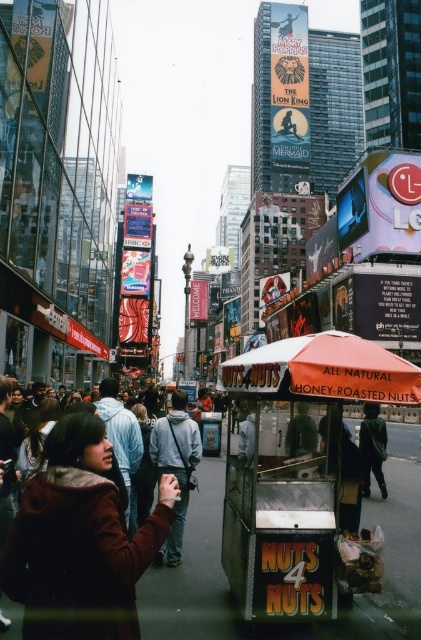
Question: Can you confirm if orange fabric umbrella at center is bigger than gray fabric jacket at center?

Choices:
 (A) no
 (B) yes

Answer: (B)

Question: Among these points, which one is farthest from the camera?

Choices:
 (A) (162, 417)
 (B) (343, 360)

Answer: (A)

Question: Can you confirm if orange fabric umbrella at center is positioned above gray fabric jacket at center?

Choices:
 (A) no
 (B) yes

Answer: (B)

Question: Is orange fabric umbrella at center to the left of gray fabric jacket at center from the viewer's perspective?

Choices:
 (A) no
 (B) yes

Answer: (A)